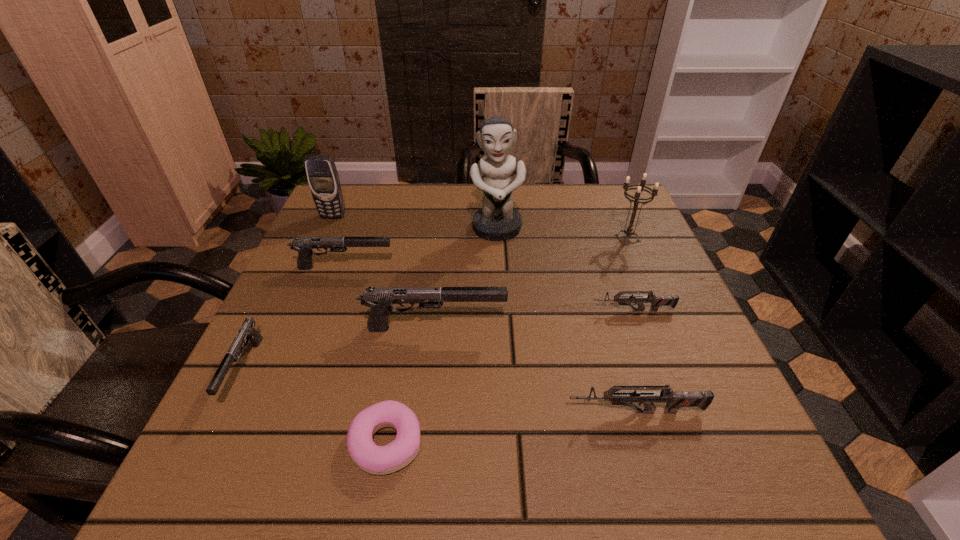
Locate an element on the screen. The width and height of the screenshot is (960, 540). the fifth farthest object is located at coordinates (656, 301).

Identify the location of the eighth tallest object. The width and height of the screenshot is (960, 540). (656, 301).

Image resolution: width=960 pixels, height=540 pixels. Find the location of `the shortest object`. the shortest object is located at coordinates (379, 460).

Identify the location of pastry. The width and height of the screenshot is (960, 540). (379, 460).

Identify the location of vacant position located on the front-facing side of the green figurine. (499, 281).

At what (x,y) coordinates should I click in order to perform the action: click on free region located 0.060m on the front face of the cellular telephone. Please return your answer as a coordinate pair (x, y). The height and width of the screenshot is (540, 960). Looking at the image, I should click on (325, 234).

What are the coordinates of `free space located on the back of the candle holder` in the screenshot? It's located at point(609,194).

Locate an element on the screen. Image resolution: width=960 pixels, height=540 pixels. blank space located at the muzzle end of the second nearest gray gun is located at coordinates (607, 328).

Locate an element on the screen. This screenshot has height=540, width=960. vacant space situated at the muzzle end of the fourth shortest gun is located at coordinates click(x=462, y=267).

Image resolution: width=960 pixels, height=540 pixels. I want to click on free space located aimed along the barrel of the nearer grey gun, so click(346, 412).